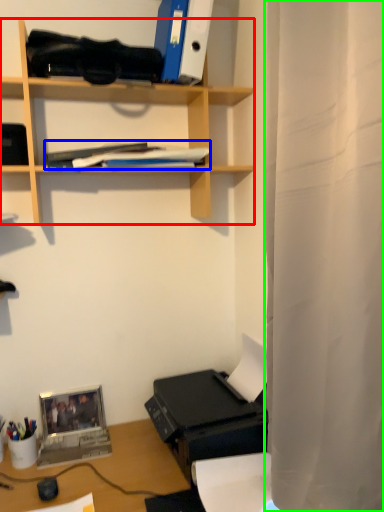
Question: Estimate the real-world distances between objects in this image. Which object is farther from shelf (highlighted by a red box), book (highlighted by a blue box) or shower curtain (highlighted by a green box)?

Choices:
 (A) book
 (B) shower curtain

Answer: (B)